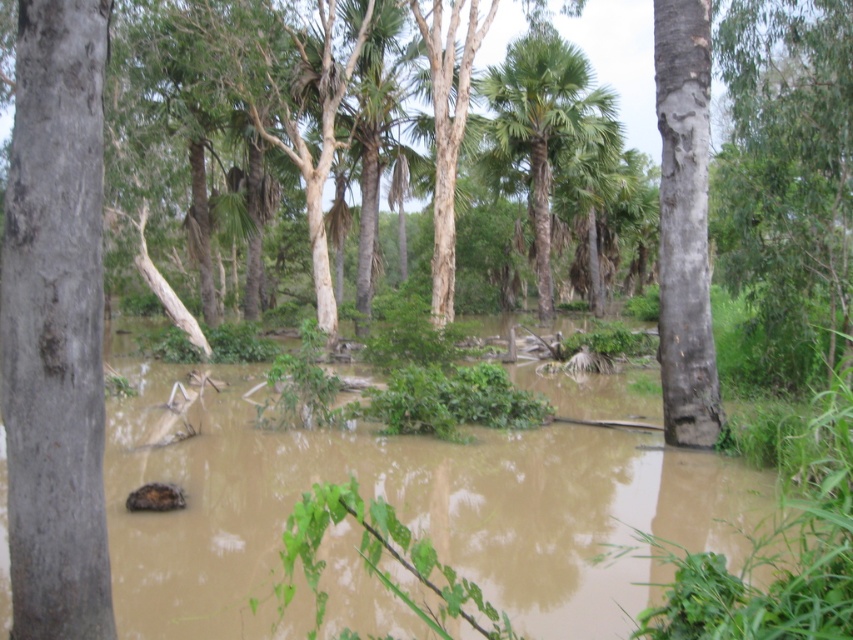
This screenshot has height=640, width=853. What do you see at coordinates (55, 324) in the screenshot? I see `gray rough bark tree at left` at bounding box center [55, 324].

Is gray rough bark tree at left below green leafy palm tree at center?

Yes.

Where is `gray rough bark tree at left`? This screenshot has height=640, width=853. gray rough bark tree at left is located at coordinates (55, 324).

Identify the location of gray rough bark tree at left. (55, 324).

Image resolution: width=853 pixels, height=640 pixels. I want to click on smooth gray bark at right, so [683, 224].

Does smooth gray bark at right have a lesser height compared to green leafy palm tree at center?

Yes.

Which is behind, point (689, 353) or point (519, 109)?

Point (519, 109)

Locate an element on the screen. This screenshot has height=640, width=853. smooth gray bark at right is located at coordinates (683, 224).

What do you see at coordinates (55, 324) in the screenshot? I see `gray rough bark tree at left` at bounding box center [55, 324].

Between gray rough bark tree at left and smooth gray bark at right, which one has more height?

Standing taller between the two is smooth gray bark at right.

Which is in front, point (51, 518) or point (663, 76)?

Point (51, 518) is more forward.

This screenshot has height=640, width=853. Identify the location of gray rough bark tree at left. (55, 324).